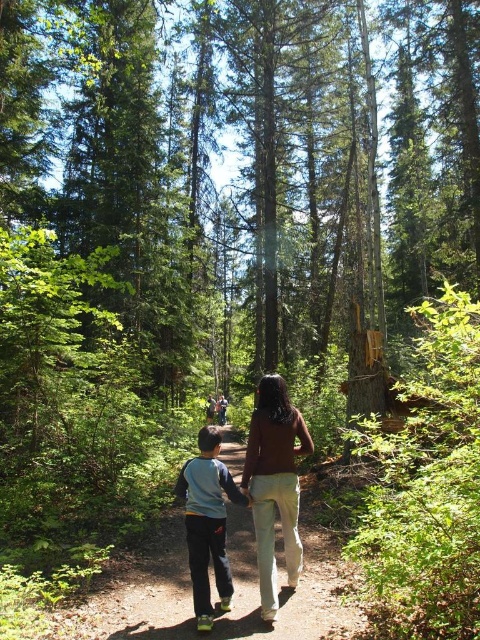
You are a hiker trying to follow the dirt path at center while avoiding stepping on the brown matte shirt at center. Which direction should you walk to stay on the path and avoid the shirt?

The dirt path at center is positioned under the brown matte shirt at center, so to stay on the path and avoid the shirt, you should walk forward along the dirt path at center beneath the brown matte shirt at center.